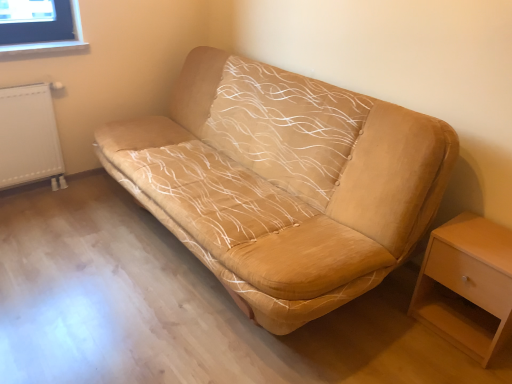
Find the location of a particular element. This screenshot has width=512, height=384. vacant region to the right of white textured radiator at left is located at coordinates (83, 196).